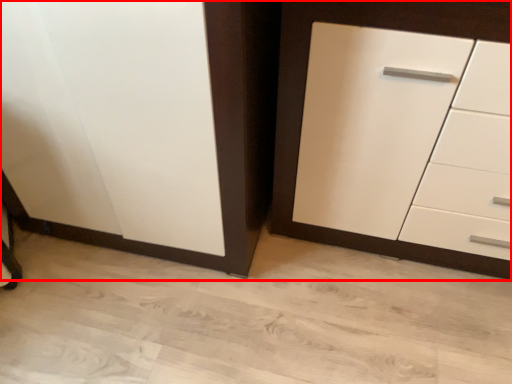
Question: From the image's perspective, what is the correct spatial relationship of cupboard (annotated by the red box) in relation to chest of drawers?

Choices:
 (A) above
 (B) below

Answer: (A)